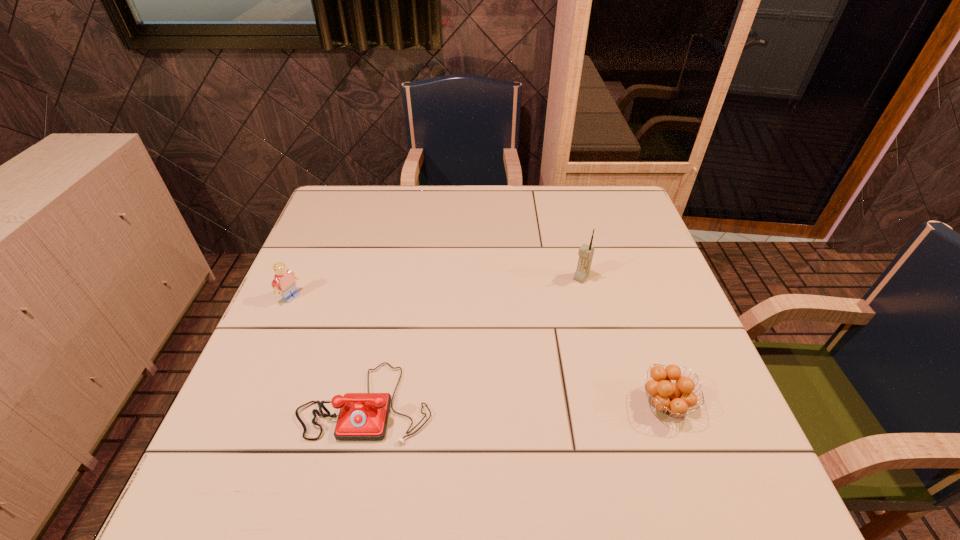
This screenshot has width=960, height=540. In order to click on free space at the far edge of the desktop in this screenshot , I will do `click(544, 193)`.

The image size is (960, 540). I want to click on free space at the left edge, so click(302, 347).

Where is `vacant space at the right edge of the desktop`? This screenshot has height=540, width=960. vacant space at the right edge of the desktop is located at coordinates (639, 354).

You are a GUI agent. You are given a task and a screenshot of the screen. Output one action in this format:
    pyautogui.click(x=<x>, y=<y>)
    Task: Click on the free space at the far left corner of the desktop
    
    Given the screenshot: What is the action you would take?
    pyautogui.click(x=320, y=213)

At what (x,y) coordinates should I click in order to perform the action: click on free space at the near left corner of the desktop. Please return your answer as a coordinate pair (x, y). The height and width of the screenshot is (540, 960). Looking at the image, I should click on (245, 417).

What are the coordinates of `free space at the far right corner of the desktop` in the screenshot? It's located at (595, 187).

Identify the location of free spot between the telephone and the leftmost object. (329, 349).

Find the location of a particular element. empty space that is in between the leftmost object and the second object from right to left is located at coordinates (436, 287).

The width and height of the screenshot is (960, 540). Identify the location of empty space between the cellular telephone and the second tallest object. (436, 287).

You are a GUI agent. You are given a task and a screenshot of the screen. Output one action in this format:
    pyautogui.click(x=<x>, y=<y>)
    Task: Click on the vacant space that is in between the second object from right to left and the Lego
    The height and width of the screenshot is (540, 960).
    Given the screenshot: What is the action you would take?
    pyautogui.click(x=436, y=287)